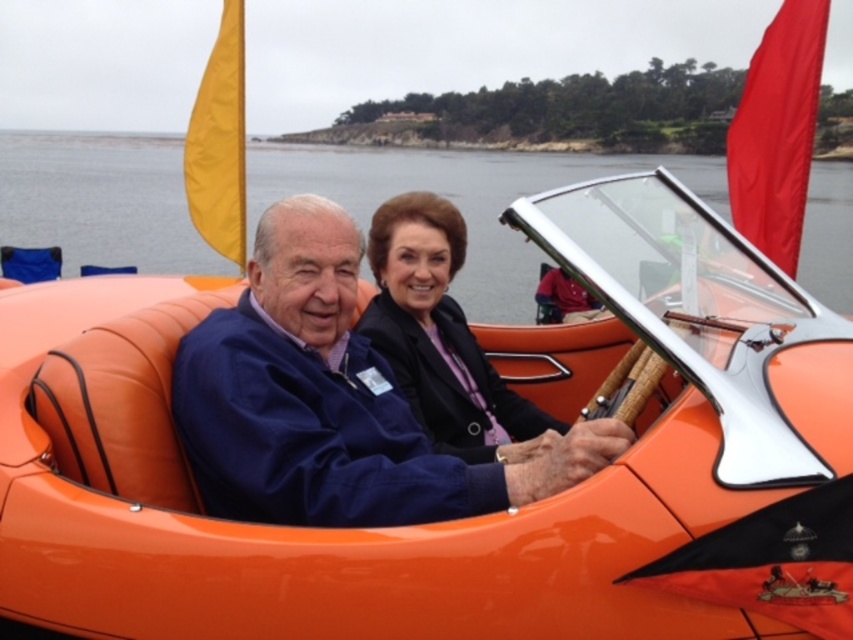
You are a photographer trying to capture the perfect shot of the matte blue jacket at center and the matte black jacket at center. Which jacket should you focus on first if you want to capture the one that is more to the left?

The matte blue jacket at center is positioned on the left side of the matte black jacket at center, so you should focus on the matte blue jacket at center first.

You are a photographer trying to capture a photo of the orange leather water at center and the matte black jacket at center. Which object should you zoom in on to ensure both are clearly visible in the frame?

The orange leather water at center is bigger than the matte black jacket at center, so you should zoom in on the smaller matte black jacket at center to ensure both are clearly visible in the frame.

You are a photographer trying to capture a photo of the matte blue jacket at center and the orange leather water at center. Which object should you focus on first if you want to ensure both are in focus without adjusting the camera settings?

The matte blue jacket at center has a lesser height compared to orange leather water at center. Since the matte blue jacket at center is closer to the camera, you should focus on it first to ensure both are in focus.